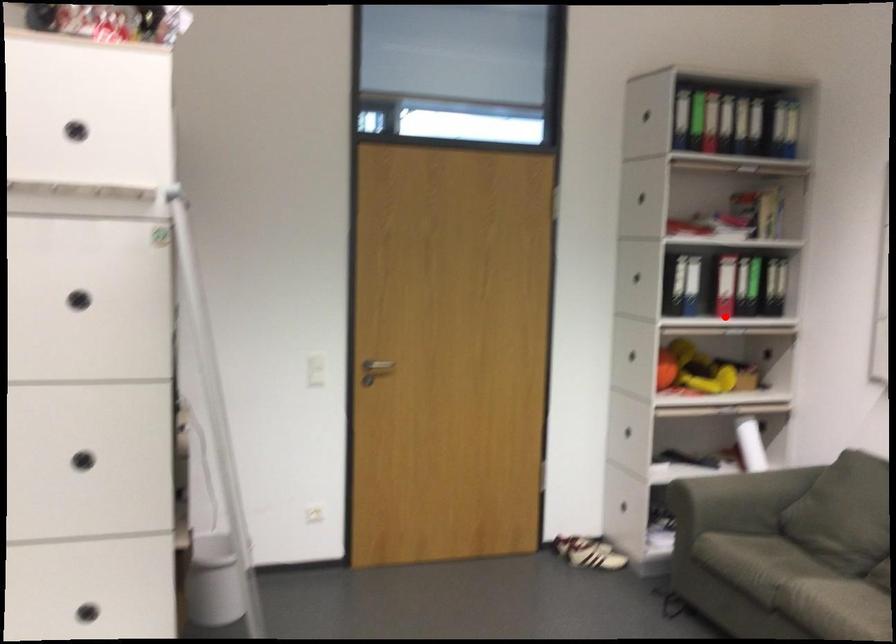
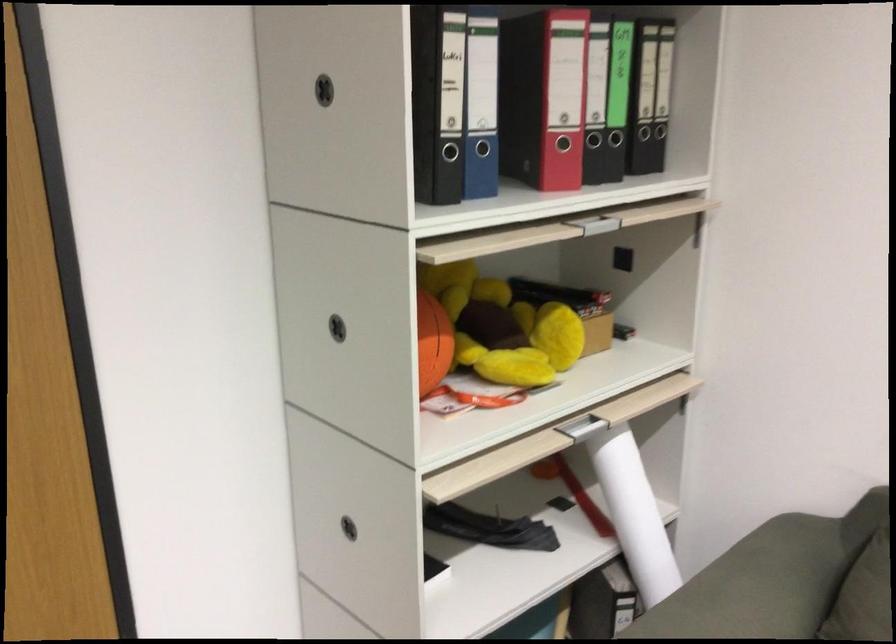
Locate, in the second image, the point that corresponds to the highlighted location in the first image.

(573, 219)